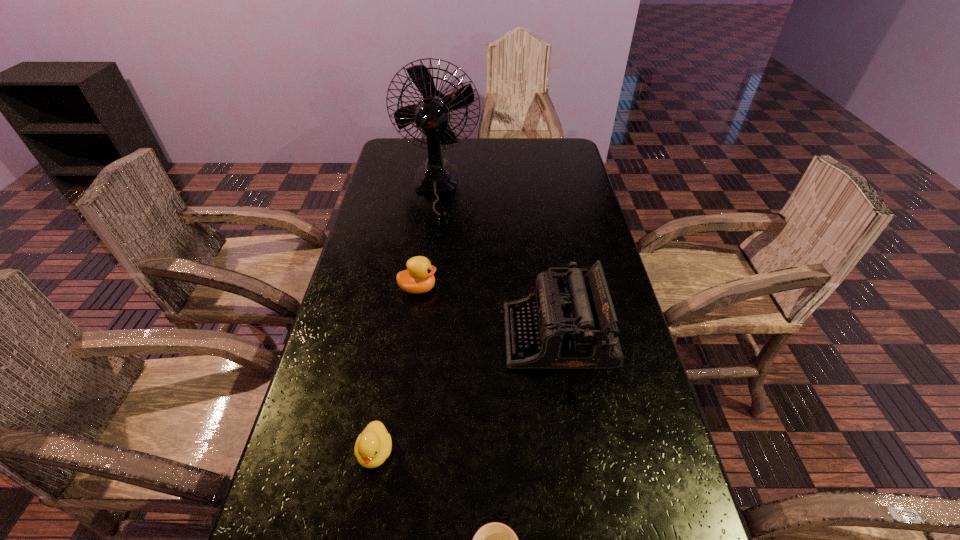
At what (x,y) coordinates should I click in order to perform the action: click on vacant space at the far left corner. Please return your answer as a coordinate pair (x, y). Looking at the image, I should click on (410, 163).

The height and width of the screenshot is (540, 960). I want to click on vacant space at the far right corner of the desktop, so click(567, 140).

Image resolution: width=960 pixels, height=540 pixels. I want to click on empty location between the fourth nearest object and the farthest object, so click(x=427, y=239).

Locate an element on the screen. The height and width of the screenshot is (540, 960). free spot between the shorter duckling and the typewriter is located at coordinates (467, 394).

Where is `free point between the tallest object and the fourth farthest object`? free point between the tallest object and the fourth farthest object is located at coordinates (405, 321).

The image size is (960, 540). In order to click on free space that is in between the fourth shortest object and the farthest object in this screenshot , I will do `click(496, 262)`.

The height and width of the screenshot is (540, 960). I want to click on empty space that is in between the taller duckling and the nearer duckling, so click(396, 370).

You are a GUI agent. You are given a task and a screenshot of the screen. Output one action in this format:
    pyautogui.click(x=<x>, y=<y>)
    Task: Click on the free spot between the third tallest object and the second tallest object
    
    Given the screenshot: What is the action you would take?
    pyautogui.click(x=488, y=312)

I want to click on the third closest object to the cup, so click(419, 277).

Select which object appears as the second closest to the tallest object. Please provide its 2D coordinates. Your answer should be formatted as a tuple, i.e. [(x, y)], where the tuple contains the x and y coordinates of a point satisfying the conditions above.

[(573, 325)]